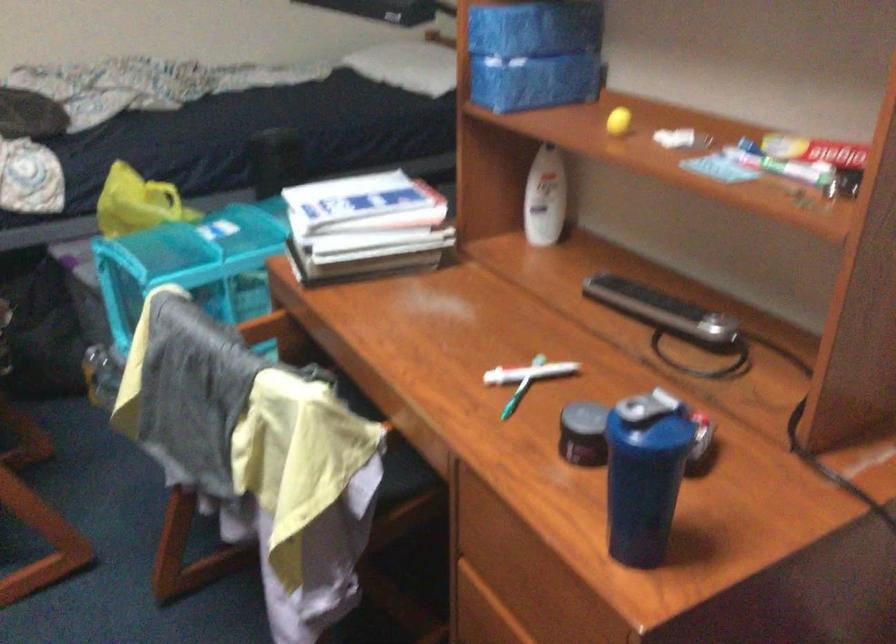
I want to click on cyan container lid, so click(205, 239).